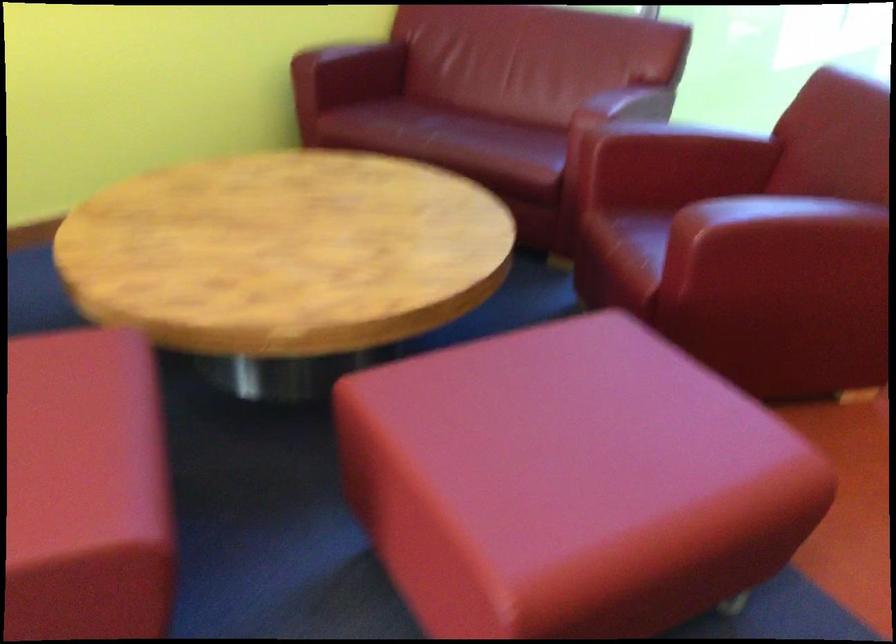
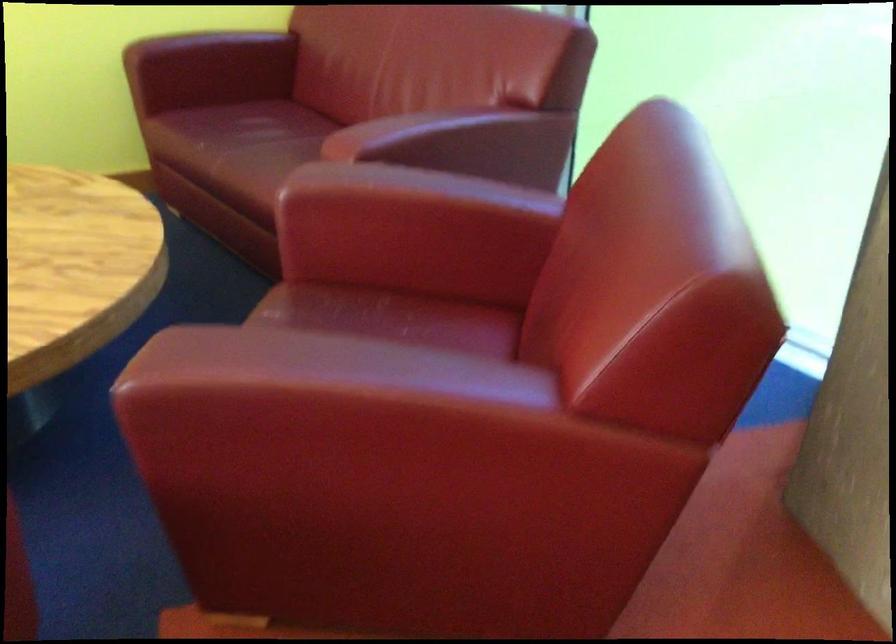
The point at (629,105) is marked in the first image. Where is the corresponding point in the second image?

(438, 137)